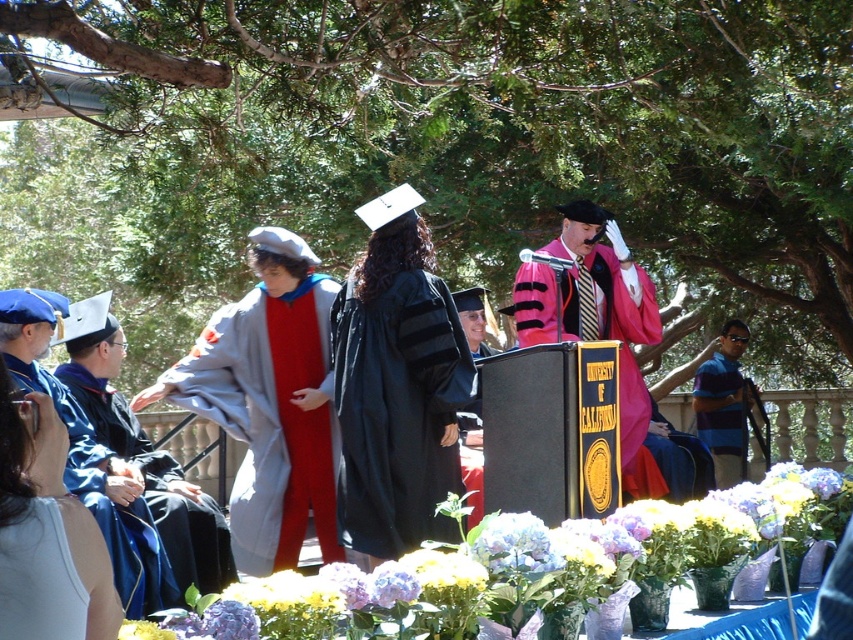
Question: Observing the image, what is the correct spatial positioning of blue satin gown at lower left in reference to white matte robe at lower left?

Choices:
 (A) right
 (B) left

Answer: (B)

Question: Which of the following is the farthest from the observer?

Choices:
 (A) blue satin gown at lower left
 (B) white matte robe at lower left
 (C) matte pink fabric graduation gown at center
 (D) blue velvet gown at left

Answer: (C)

Question: Which object appears farthest from the camera in this image?

Choices:
 (A) pastel hydrangea at center
 (B) black matte graduation gown at center

Answer: (B)

Question: Does pastel hydrangea at center come in front of black matte graduation gown at center?

Choices:
 (A) yes
 (B) no

Answer: (A)

Question: Is matte pink fabric graduation gown at center smaller than striped polo shirt at right?

Choices:
 (A) yes
 (B) no

Answer: (B)

Question: Among these objects, which one is farthest from the camera?

Choices:
 (A) black matte graduation gown at center
 (B) pastel hydrangea at center
 (C) white matte robe at lower left

Answer: (A)